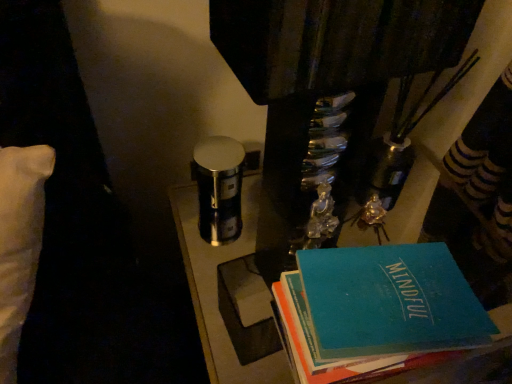
This screenshot has height=384, width=512. Describe the element at coordinates (387, 302) in the screenshot. I see `teal matte book at lower right` at that location.

At what (x,y) coordinates should I click in order to perform the action: click on teal matte book at lower right. Please return your answer as a coordinate pair (x, y). Image resolution: width=512 pixels, height=384 pixels. Looking at the image, I should click on (387, 302).

What is the approximate width of metallic/reflective table at center?

The width of metallic/reflective table at center is 42.07 centimeters.

Measure the distance between point (x=189, y=286) and camera.

Point (x=189, y=286) and camera are 37.68 inches apart from each other.

Image resolution: width=512 pixels, height=384 pixels. What do you see at coordinates (216, 288) in the screenshot? I see `metallic/reflective table at center` at bounding box center [216, 288].

This screenshot has height=384, width=512. Identify the location of metallic/reflective table at center. (216, 288).

Identify the location of teal matte book at lower right. (387, 302).

Is teal matte book at lower right to the right of metallic/reflective table at center from the viewer's perspective?

Yes, teal matte book at lower right is to the right of metallic/reflective table at center.

In the scene shown: In the image, is teal matte book at lower right positioned in front of or behind metallic/reflective table at center?

teal matte book at lower right is in front of metallic/reflective table at center.

Is point (319, 255) closer or farther from the camera than point (250, 381)?

Point (319, 255) appears to be closer to the viewer than point (250, 381).

From the image's perspective, is teal matte book at lower right above or below metallic/reflective table at center?

Clearly, from the image's perspective, teal matte book at lower right is above metallic/reflective table at center.

From a real-world perspective, which is physically below, teal matte book at lower right or metallic/reflective table at center?

metallic/reflective table at center, from a real-world perspective.

Considering the sizes of objects teal matte book at lower right and metallic/reflective table at center in the image provided, who is thinner, teal matte book at lower right or metallic/reflective table at center?

With smaller width is teal matte book at lower right.

Who is shorter, teal matte book at lower right or metallic/reflective table at center?

teal matte book at lower right.

Considering the relative sizes of teal matte book at lower right and metallic/reflective table at center in the image provided, is teal matte book at lower right smaller than metallic/reflective table at center?

Correct, teal matte book at lower right occupies less space than metallic/reflective table at center.

In the scene shown: Do you think teal matte book at lower right is within metallic/reflective table at center, or outside of it?

teal matte book at lower right exists outside the volume of metallic/reflective table at center.

Is teal matte book at lower right directly adjacent to metallic/reflective table at center?

teal matte book at lower right is not next to metallic/reflective table at center, and they're not touching.

Is teal matte book at lower right oriented away from metallic/reflective table at center?

That's not correct — teal matte book at lower right is not looking away from metallic/reflective table at center.

How different are the orientations of teal matte book at lower right and metallic/reflective table at center in degrees?

teal matte book at lower right and metallic/reflective table at center are facing 5.1 degrees away from each other.

Measure the distance between teal matte book at lower right and metallic/reflective table at center.

teal matte book at lower right and metallic/reflective table at center are 13.42 inches apart.

Where is `table lying on the left of teal matte book at lower right`? table lying on the left of teal matte book at lower right is located at coordinates (216, 288).

Consider the image. Does metallic/reflective table at center appear on the left side of teal matte book at lower right?

Indeed, metallic/reflective table at center is positioned on the left side of teal matte book at lower right.

Relative to teal matte book at lower right, is metallic/reflective table at center in front or behind?

Visually, metallic/reflective table at center is located behind teal matte book at lower right.

Which is closer, (228, 362) or (317, 300)?

Point (228, 362) is farther from the camera than point (317, 300).

From the image's perspective, is metallic/reflective table at center over teal matte book at lower right?

No.

From a real-world perspective, who is located higher, metallic/reflective table at center or teal matte book at lower right?

From a 3D spatial view, teal matte book at lower right is above.

Is metallic/reflective table at center wider than teal matte book at lower right?

Yes, metallic/reflective table at center is wider than teal matte book at lower right.

Can you confirm if metallic/reflective table at center is taller than teal matte book at lower right?

Indeed, metallic/reflective table at center has a greater height compared to teal matte book at lower right.

Based on their sizes in the image, would you say metallic/reflective table at center is bigger or smaller than teal matte book at lower right?

Considering their sizes, metallic/reflective table at center takes up more space than teal matte book at lower right.

Is metallic/reflective table at center located outside teal matte book at lower right?

That's correct, metallic/reflective table at center is outside of teal matte book at lower right.

Is there a large distance between metallic/reflective table at center and teal matte book at lower right?

No, metallic/reflective table at center is not far from teal matte book at lower right.

Is metallic/reflective table at center aimed at teal matte book at lower right?

No, metallic/reflective table at center does not turn towards teal matte book at lower right.

Image resolution: width=512 pixels, height=384 pixels. I want to click on book on the right side of metallic/reflective table at center, so click(x=387, y=302).

The width and height of the screenshot is (512, 384). In the image, there is a teal matte book at lower right. Find the location of `table below it (from a real-world perspective)`. table below it (from a real-world perspective) is located at coordinates (216, 288).

You are a GUI agent. You are given a task and a screenshot of the screen. Output one action in this format:
    pyautogui.click(x=<x>, y=<y>)
    Task: Click on the table lying behind the teal matte book at lower right
    The image size is (512, 384).
    Given the screenshot: What is the action you would take?
    [216, 288]